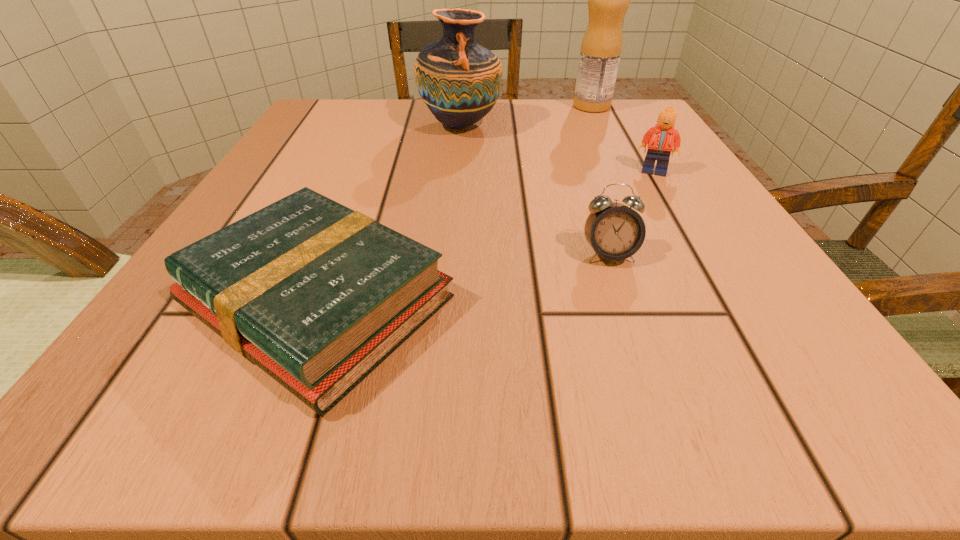
Locate an element on the screen. The height and width of the screenshot is (540, 960). vacant space situated on the face of the alarm clock is located at coordinates (666, 422).

What are the coordinates of `vacant space located 0.130m on the right of the hardback book` in the screenshot? It's located at (563, 301).

Locate an element on the screen. fruit juice positioned at the far edge is located at coordinates (608, 0).

Identify the location of pottery positioned at the far edge. (459, 80).

You are a GUI agent. You are given a task and a screenshot of the screen. Output one action in this format:
    pyautogui.click(x=<x>, y=<y>)
    Task: Click on the object at the near edge
    
    Given the screenshot: What is the action you would take?
    pyautogui.click(x=317, y=295)

Where is `object positioned at the left edge`? The width and height of the screenshot is (960, 540). object positioned at the left edge is located at coordinates (317, 295).

The width and height of the screenshot is (960, 540). I want to click on fruit juice that is at the right edge, so click(x=608, y=0).

This screenshot has height=540, width=960. In order to click on Lego that is positioned at the right edge in this screenshot , I will do `click(660, 138)`.

You are a GUI agent. You are given a task and a screenshot of the screen. Output one action in this format:
    pyautogui.click(x=<x>, y=<y>)
    Task: Click on the alarm clock that is at the right edge
    This screenshot has height=540, width=960.
    Given the screenshot: What is the action you would take?
    tap(615, 231)

The image size is (960, 540). Find the location of `object that is positioned at the near left corner`. object that is positioned at the near left corner is located at coordinates (317, 295).